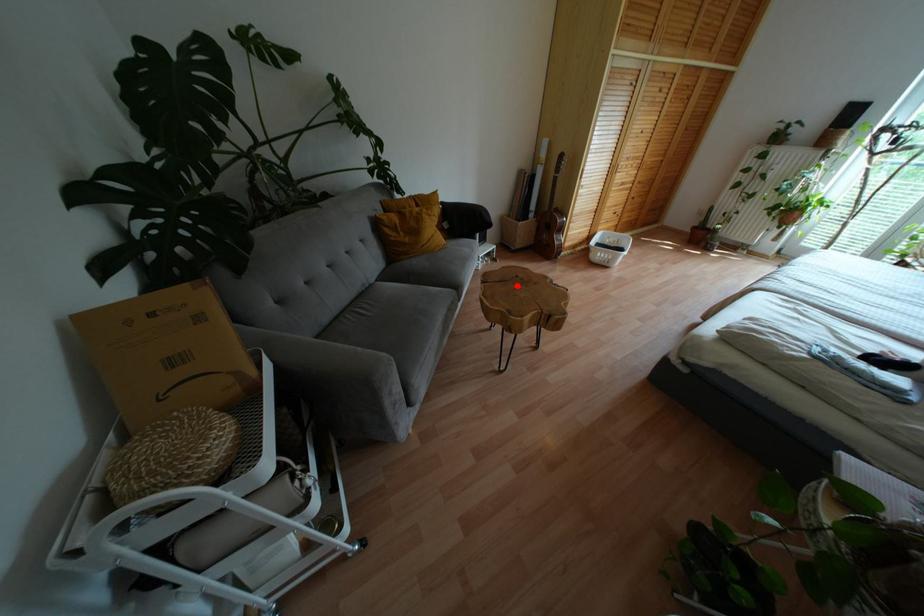
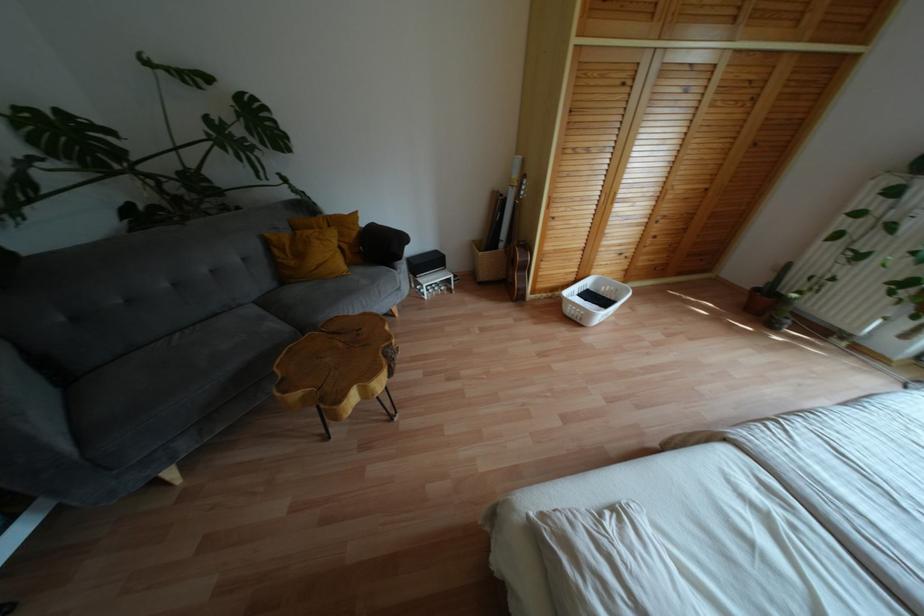
Find the pixel in the second image that matches the highlighted location in the first image.

(341, 344)